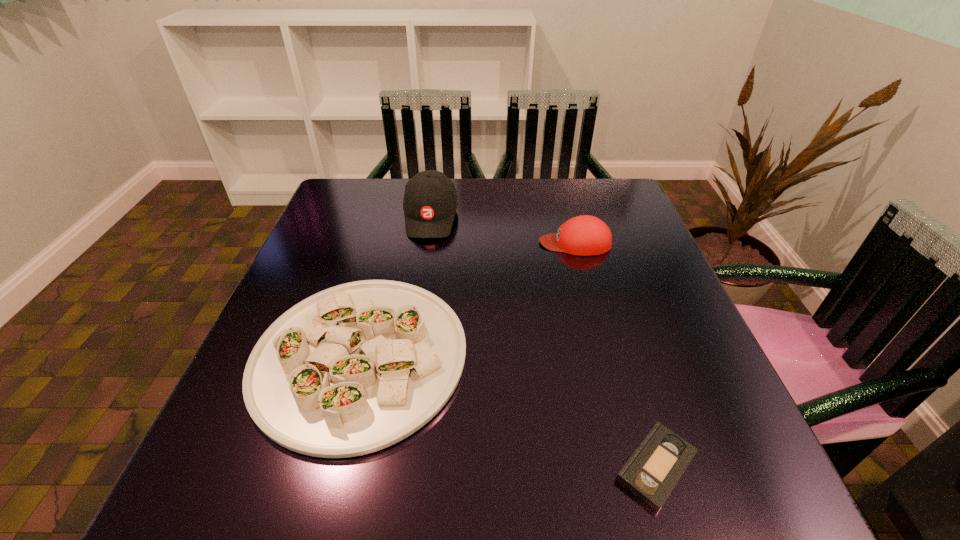
Identify the location of free space located on the left of the shortest object. (514, 467).

Where is `object located in the far edge section of the desktop`? The image size is (960, 540). object located in the far edge section of the desktop is located at coordinates (430, 202).

The width and height of the screenshot is (960, 540). What are the coordinates of `platter located at the near edge` in the screenshot? It's located at (353, 369).

Identify the location of videotape that is at the near edge. The height and width of the screenshot is (540, 960). (651, 473).

Where is `object that is positioned at the left edge`? This screenshot has width=960, height=540. object that is positioned at the left edge is located at coordinates 353,369.

Locate an element on the screen. baseball cap situated at the right edge is located at coordinates (585, 235).

You are a GUI agent. You are given a task and a screenshot of the screen. Output one action in this format:
    pyautogui.click(x=<x>, y=<y>)
    Task: Click on the videotape at the right edge
    Image resolution: width=960 pixels, height=540 pixels.
    Given the screenshot: What is the action you would take?
    pyautogui.click(x=651, y=473)

Where is `object that is at the near left corner`? object that is at the near left corner is located at coordinates (353, 369).

This screenshot has width=960, height=540. Find the location of `object at the near right corner`. object at the near right corner is located at coordinates (651, 473).

You are a GUI agent. You are given a task and a screenshot of the screen. Output one action in this format:
    pyautogui.click(x=<x>, y=<y>)
    Task: Click on the free space at the far edge of the desktop
    Image resolution: width=960 pixels, height=540 pixels.
    Given the screenshot: What is the action you would take?
    pyautogui.click(x=474, y=213)